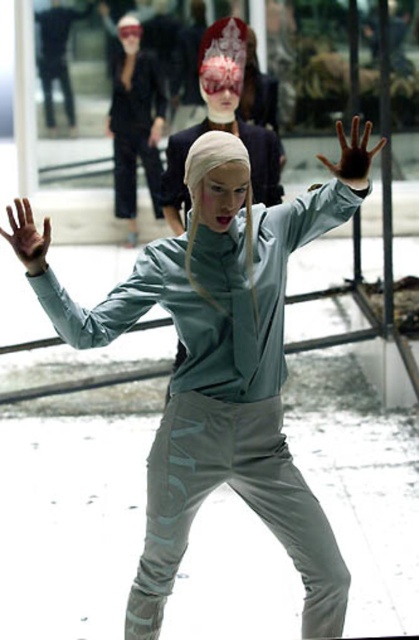
Question: Which point is closer to the camera?

Choices:
 (A) (22, 260)
 (B) (191, 189)

Answer: (A)

Question: Which point is farther to the camera?

Choices:
 (A) [x=181, y=221]
 (B) [x=362, y=160]
 (C) [x=5, y=348]
 (D) [x=123, y=22]

Answer: (D)

Question: Is matte black suit at upper center further to camera compared to matte gray arm at center?

Choices:
 (A) yes
 (B) no

Answer: (A)

Question: Can you confirm if matte gray shirt at center is positioned below satin fabric arm at center?

Choices:
 (A) no
 (B) yes

Answer: (B)

Question: Is matte black arm at upper center to the left of matte black hand at upper center from the viewer's perspective?

Choices:
 (A) yes
 (B) no

Answer: (A)

Question: Which point is closer to the camera?

Choices:
 (A) (13, 241)
 (B) (152, 132)
 (C) (362, 157)
 (D) (173, 228)

Answer: (A)